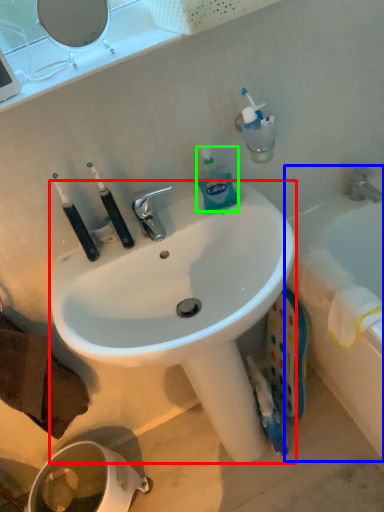
Question: Which object is the farthest from sink (highlighted by a red box)? Choose among these: bathtub (highlighted by a blue box) or bottle (highlighted by a green box).

Choices:
 (A) bathtub
 (B) bottle

Answer: (A)